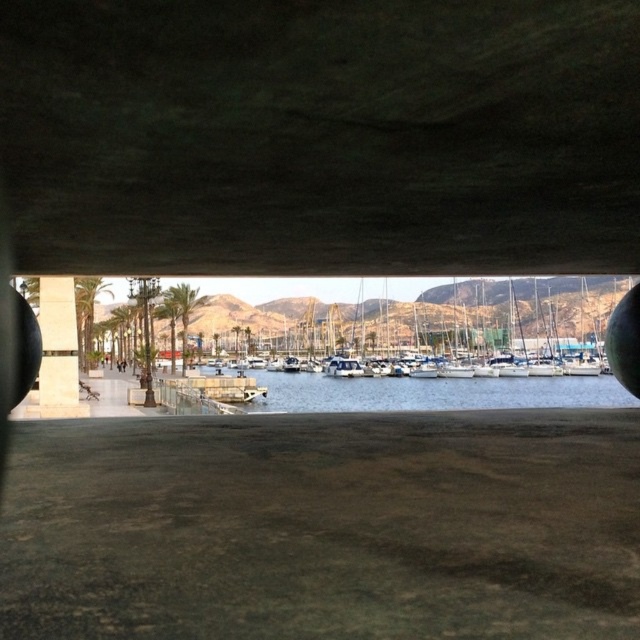
You are a delivery drone that needs to pass under the dark concrete overpass at upper center to reach the clear water at center. Can you safely navigate through the space between them?

The dark concrete overpass at upper center is thinner than clear water at center, so the space between them is narrow. The drone must ensure its width is less than the available space to safely pass through.

In the scene shown: You are standing on the structure looking down at the marina. Which object is closer to you between the white glossy boats at center and the clear water at center?

The white glossy boats at center are closer to you than the clear water at center, as they are positioned further to the viewer.

You are navigating a small boat in the marina and need to pass under the dark concrete overpass at upper center. Based on the coordinates provided, can you determine if your boat with a height of 2 meters will safely pass underneath?

The dark concrete overpass at upper center is located at point (321, 134), which indicates its position but does not provide information about its clearance height. Without knowing the vertical clearance, it is impossible to determine if the boat will safely pass underneath.